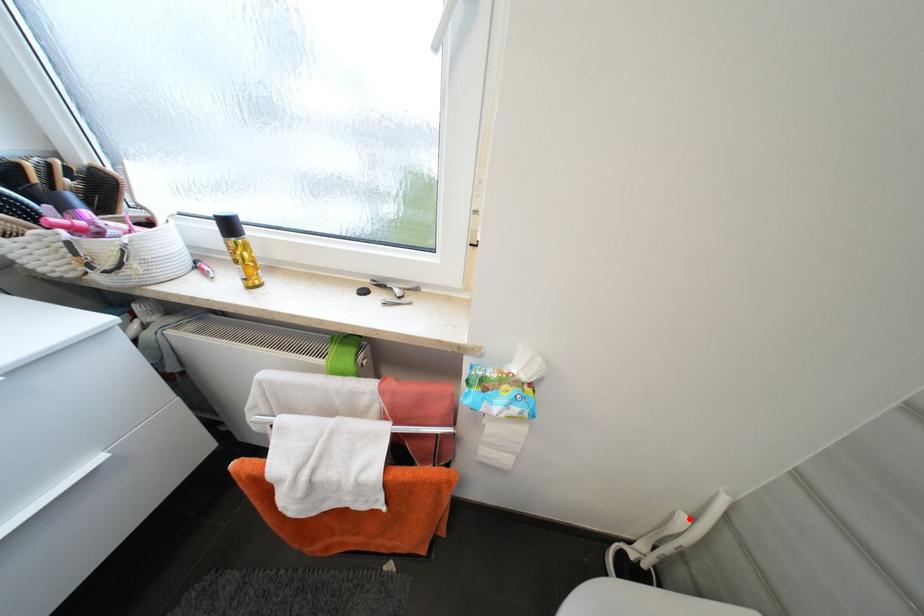
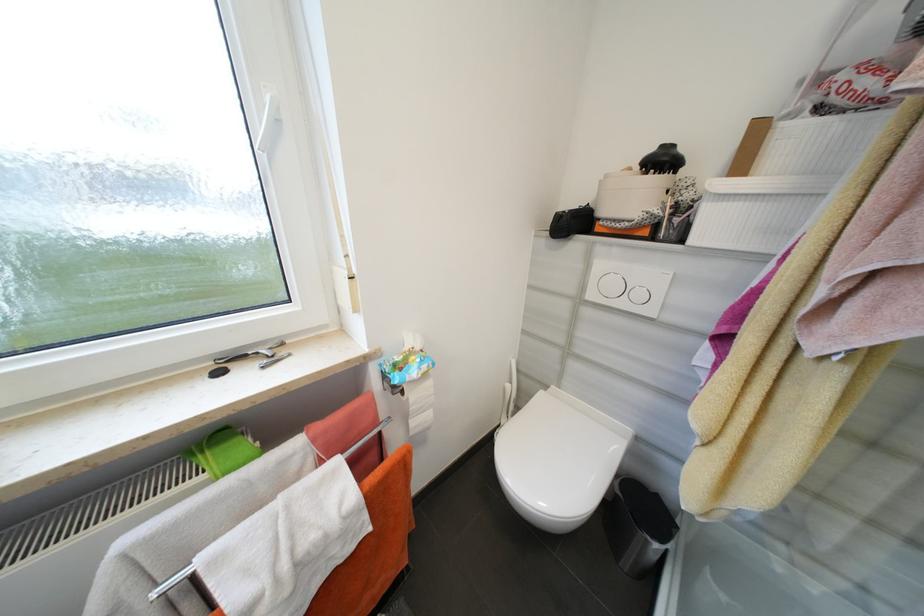
Where in the second image is the point corresponding to the highlighted location from the first image?

(514, 387)